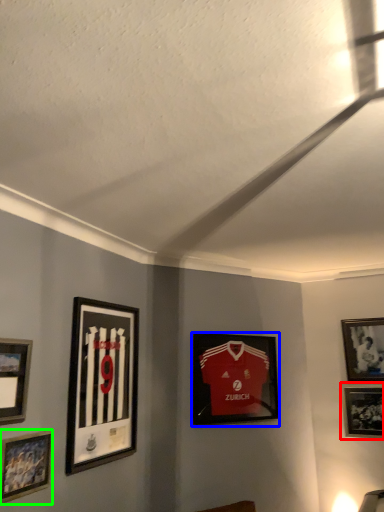
Question: Considering the real-world distances, which object is farthest from picture frame (highlighted by a red box)? picture frame (highlighted by a blue box) or picture frame (highlighted by a green box)?

Choices:
 (A) picture frame
 (B) picture frame

Answer: (B)